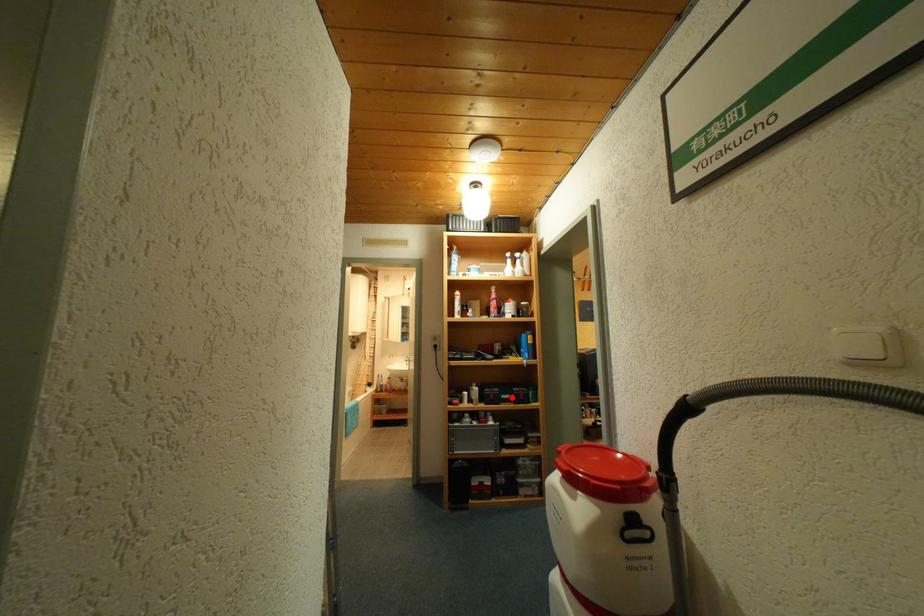
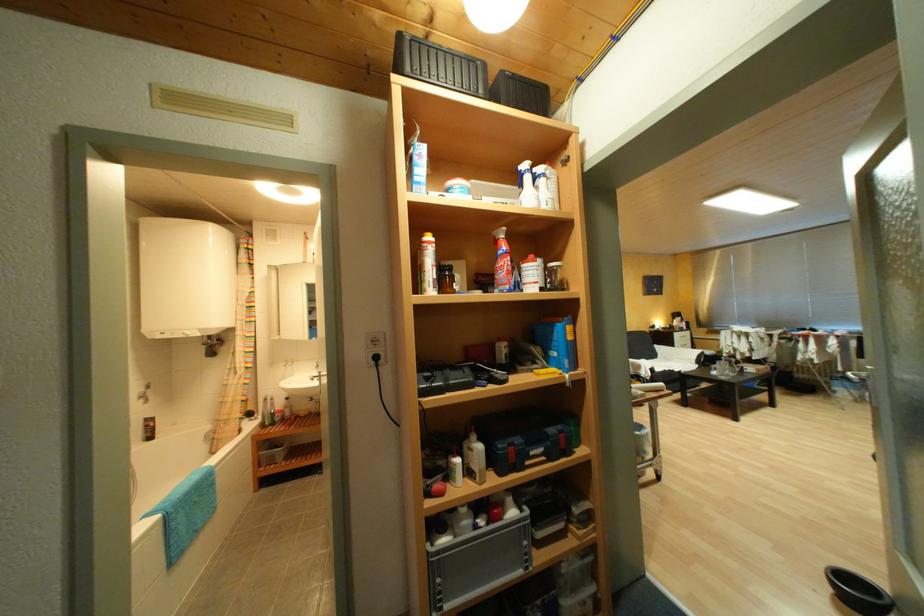
Question: A red point is marked in image1. In image2, is the corresponding 3D point closer to the camera or farther? Reply with the corresponding letter.

Choices:
 (A) The corresponding 3D point is closer.
 (B) The corresponding 3D point is farther.

Answer: (A)